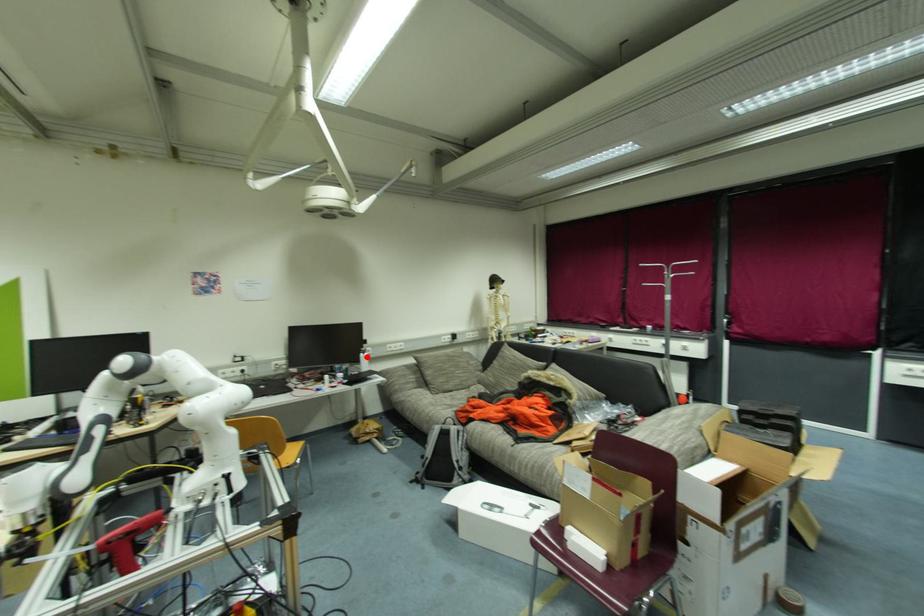
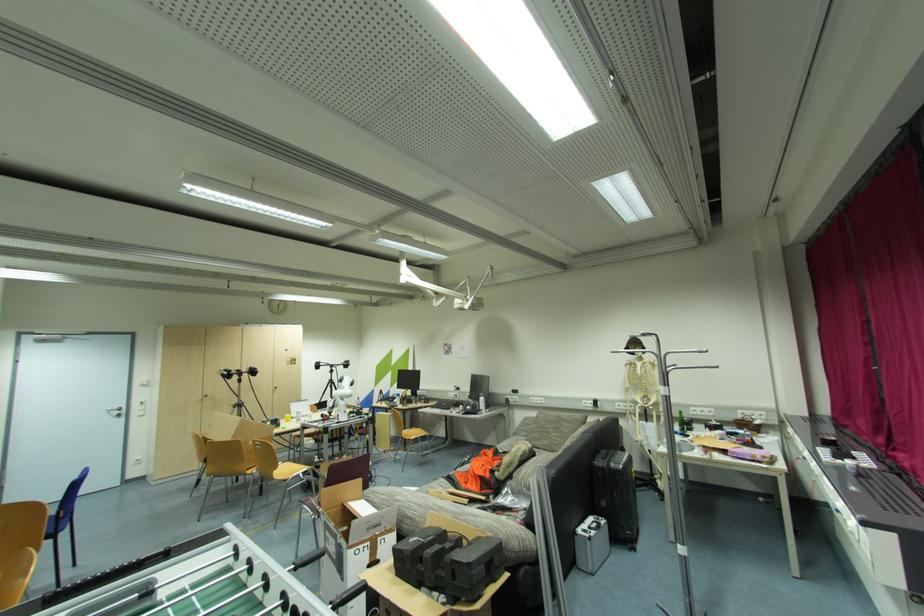
Question: I am providing you with two images of the same scene from different viewpoints. A red point is marked on the first image. Is the red point's position out of view in image 2?

Choices:
 (A) Yes
 (B) No

Answer: (B)